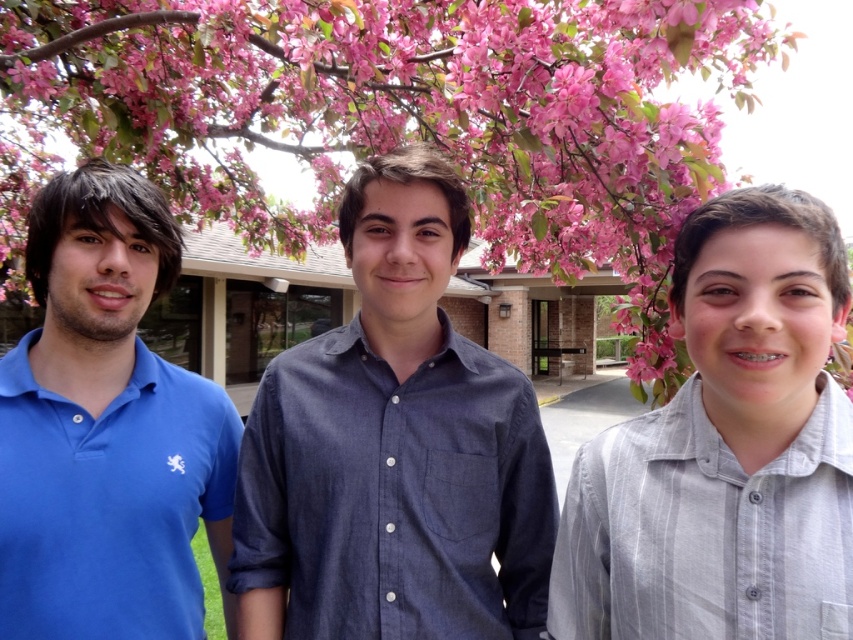
Question: Estimate the real-world distances between objects in this image. Which object is farther from the gray striped shirt at center?

Choices:
 (A) matte blue polo shirt at left
 (B) pink blossoms at upper center

Answer: (B)

Question: Which object is the closest to the matte blue polo shirt at left?

Choices:
 (A) pink blossoms at upper center
 (B) gray striped shirt at center

Answer: (B)

Question: Does blue cotton polo shirt at center appear on the right side of matte blue polo shirt at left?

Choices:
 (A) yes
 (B) no

Answer: (A)

Question: Does pink blossoms at upper center have a greater width compared to blue cotton polo shirt at center?

Choices:
 (A) no
 (B) yes

Answer: (B)

Question: Estimate the real-world distances between objects in this image. Which object is farther from the pink blossoms at upper center?

Choices:
 (A) gray striped shirt at center
 (B) matte blue polo shirt at left
 (C) blue cotton polo shirt at center

Answer: (B)

Question: Where is pink blossoms at upper center located in relation to blue cotton polo shirt at center in the image?

Choices:
 (A) above
 (B) below

Answer: (A)